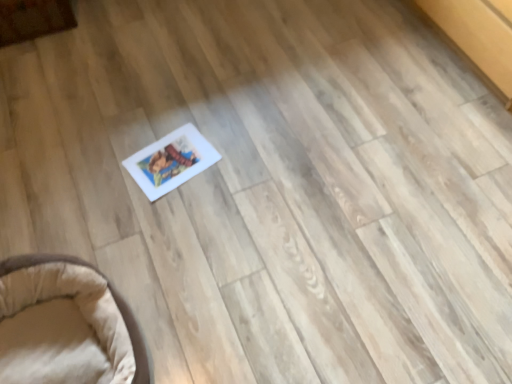
Describe the element at coordinates (114, 300) in the screenshot. I see `beige fabric pet bed at lower left, which is the second furniture from back to front` at that location.

The height and width of the screenshot is (384, 512). Find the location of `beige fabric pet bed at lower left, which appears as the second furniture when viewed from the left`. beige fabric pet bed at lower left, which appears as the second furniture when viewed from the left is located at coordinates tap(114, 300).

How much space does wooden cabinet at upper left, the second furniture in the front-to-back sequence, occupy vertically?

→ wooden cabinet at upper left, the second furniture in the front-to-back sequence, is 7.78 inches in height.

Where is `wooden cabinet at upper left, the 1th furniture from the left`? The width and height of the screenshot is (512, 384). wooden cabinet at upper left, the 1th furniture from the left is located at coordinates (33, 19).

The width and height of the screenshot is (512, 384). Describe the element at coordinates (33, 19) in the screenshot. I see `wooden cabinet at upper left, the 1th furniture from the left` at that location.

The width and height of the screenshot is (512, 384). I want to click on beige fabric pet bed at lower left, which is the first furniture in front-to-back order, so click(114, 300).

Is beige fabric pet bed at lower left, which is the first furniture in front-to-back order, at the right side of wooden cabinet at upper left, the second furniture in the front-to-back sequence?

Yes.

Which object is closer to the camera taking this photo, beige fabric pet bed at lower left, which appears as the 1th furniture when ordered from the bottom, or wooden cabinet at upper left, the 1th furniture from the left?

beige fabric pet bed at lower left, which appears as the 1th furniture when ordered from the bottom, is in front.

Considering the points (0, 266) and (22, 4), which point is in front, point (0, 266) or point (22, 4)?

The point (0, 266) is closer to the camera.

From the image's perspective, between beige fabric pet bed at lower left, which appears as the 1th furniture when ordered from the bottom, and wooden cabinet at upper left, which ranks as the second furniture in right-to-left order, which one is located above?

From the image's view, wooden cabinet at upper left, which ranks as the second furniture in right-to-left order, is above.

From a real-world perspective, which object stands above the other?

beige fabric pet bed at lower left, which is the first furniture in front-to-back order.

In the scene shown: Considering the relative sizes of beige fabric pet bed at lower left, which appears as the 1th furniture when ordered from the bottom, and wooden cabinet at upper left, the 1th furniture positioned from the top, in the image provided, is beige fabric pet bed at lower left, which appears as the 1th furniture when ordered from the bottom, wider than wooden cabinet at upper left, the 1th furniture positioned from the top,?

Yes, beige fabric pet bed at lower left, which appears as the 1th furniture when ordered from the bottom, is wider than wooden cabinet at upper left, the 1th furniture positioned from the top.

Who is shorter, beige fabric pet bed at lower left, placed as the 1th furniture when sorted from right to left, or wooden cabinet at upper left, the 1th furniture from the left?

With less height is wooden cabinet at upper left, the 1th furniture from the left.

Considering the sizes of objects beige fabric pet bed at lower left, which appears as the second furniture when viewed from the top, and wooden cabinet at upper left, the second furniture in the front-to-back sequence, in the image provided, who is bigger, beige fabric pet bed at lower left, which appears as the second furniture when viewed from the top, or wooden cabinet at upper left, the second furniture in the front-to-back sequence,?

beige fabric pet bed at lower left, which appears as the second furniture when viewed from the top, is bigger.

Can we say beige fabric pet bed at lower left, which is the second furniture from back to front, lies outside wooden cabinet at upper left, marked as the first furniture in a back-to-front arrangement?

Yes, beige fabric pet bed at lower left, which is the second furniture from back to front, is not within wooden cabinet at upper left, marked as the first furniture in a back-to-front arrangement.

Is beige fabric pet bed at lower left, placed as the 1th furniture when sorted from right to left, not close to wooden cabinet at upper left, the second furniture in the front-to-back sequence?

beige fabric pet bed at lower left, placed as the 1th furniture when sorted from right to left, is positioned a significant distance from wooden cabinet at upper left, the second furniture in the front-to-back sequence.

Could you tell me if beige fabric pet bed at lower left, which is the first furniture in front-to-back order, is facing wooden cabinet at upper left, marked as the first furniture in a back-to-front arrangement?

No, beige fabric pet bed at lower left, which is the first furniture in front-to-back order, is not aimed at wooden cabinet at upper left, marked as the first furniture in a back-to-front arrangement.

How many degrees apart are the facing directions of beige fabric pet bed at lower left, which appears as the second furniture when viewed from the left, and wooden cabinet at upper left, the 1th furniture from the left?

There is a 89.9-degree angle between the facing directions of beige fabric pet bed at lower left, which appears as the second furniture when viewed from the left, and wooden cabinet at upper left, the 1th furniture from the left.

This screenshot has height=384, width=512. In the image, there is a wooden cabinet at upper left, which ranks as the second furniture in right-to-left order. Find the location of `furniture below it (from the image's perspective)`. furniture below it (from the image's perspective) is located at coordinates (114, 300).

Which object is positioned more to the left, wooden cabinet at upper left, marked as the first furniture in a back-to-front arrangement, or beige fabric pet bed at lower left, which appears as the second furniture when viewed from the left?

wooden cabinet at upper left, marked as the first furniture in a back-to-front arrangement.

Considering the positions of objects wooden cabinet at upper left, the second furniture in the front-to-back sequence, and beige fabric pet bed at lower left, which is the first furniture in front-to-back order, in the image provided, who is in front, wooden cabinet at upper left, the second furniture in the front-to-back sequence, or beige fabric pet bed at lower left, which is the first furniture in front-to-back order,?

Positioned in front is beige fabric pet bed at lower left, which is the first furniture in front-to-back order.

Which is closer, (71, 16) or (136, 365)?

Point (71, 16) appears to be farther away from the viewer than point (136, 365).

Consider the image. From the image's perspective, is wooden cabinet at upper left, the second furniture in the front-to-back sequence, positioned above or below beige fabric pet bed at lower left, which is the first furniture in front-to-back order?

wooden cabinet at upper left, the second furniture in the front-to-back sequence, is situated higher than beige fabric pet bed at lower left, which is the first furniture in front-to-back order, in the image.

From a real-world perspective, relative to beige fabric pet bed at lower left, which is the first furniture in front-to-back order, is wooden cabinet at upper left, marked as the first furniture in a back-to-front arrangement, vertically above or below?

wooden cabinet at upper left, marked as the first furniture in a back-to-front arrangement, is situated lower than beige fabric pet bed at lower left, which is the first furniture in front-to-back order, in the real world.

Which of these two, wooden cabinet at upper left, the 1th furniture positioned from the top, or beige fabric pet bed at lower left, which is the second furniture from back to front, is thinner?

wooden cabinet at upper left, the 1th furniture positioned from the top, is thinner.

Considering the relative sizes of wooden cabinet at upper left, the second furniture in the front-to-back sequence, and beige fabric pet bed at lower left, which appears as the second furniture when viewed from the left, in the image provided, is wooden cabinet at upper left, the second furniture in the front-to-back sequence, shorter than beige fabric pet bed at lower left, which appears as the second furniture when viewed from the left,?

Correct, wooden cabinet at upper left, the second furniture in the front-to-back sequence, is not as tall as beige fabric pet bed at lower left, which appears as the second furniture when viewed from the left.

Does wooden cabinet at upper left, the 1th furniture positioned from the top, have a larger size compared to beige fabric pet bed at lower left, which appears as the second furniture when viewed from the top?

No, wooden cabinet at upper left, the 1th furniture positioned from the top, is not bigger than beige fabric pet bed at lower left, which appears as the second furniture when viewed from the top.

Looking at this image, is wooden cabinet at upper left, which ranks as the second furniture in right-to-left order, inside or outside of beige fabric pet bed at lower left, which appears as the second furniture when viewed from the left?

wooden cabinet at upper left, which ranks as the second furniture in right-to-left order, is not enclosed by beige fabric pet bed at lower left, which appears as the second furniture when viewed from the left.

Is wooden cabinet at upper left, the 1th furniture from the left, far away from beige fabric pet bed at lower left, which is the second furniture from back to front?

wooden cabinet at upper left, the 1th furniture from the left, is positioned a significant distance from beige fabric pet bed at lower left, which is the second furniture from back to front.

Is beige fabric pet bed at lower left, which appears as the second furniture when viewed from the top, at the back of wooden cabinet at upper left, marked as the first furniture in a back-to-front arrangement?

No, beige fabric pet bed at lower left, which appears as the second furniture when viewed from the top, is not at the back of wooden cabinet at upper left, marked as the first furniture in a back-to-front arrangement.

Can you tell me how much wooden cabinet at upper left, marked as the first furniture in a back-to-front arrangement, and beige fabric pet bed at lower left, which is the first furniture in front-to-back order, differ in facing direction?

The angle between the facing direction of wooden cabinet at upper left, marked as the first furniture in a back-to-front arrangement, and the facing direction of beige fabric pet bed at lower left, which is the first furniture in front-to-back order, is 89.9 degrees.

Image resolution: width=512 pixels, height=384 pixels. What are the coordinates of `furniture above the beige fabric pet bed at lower left, which appears as the second furniture when viewed from the left (from the image's perspective)` in the screenshot? It's located at (33, 19).

Where is `furniture that appears above the wooden cabinet at upper left, which ranks as the second furniture in right-to-left order (from a real-world perspective)`? The image size is (512, 384). furniture that appears above the wooden cabinet at upper left, which ranks as the second furniture in right-to-left order (from a real-world perspective) is located at coordinates (114, 300).

Locate an element on the screen. The height and width of the screenshot is (384, 512). furniture above the beige fabric pet bed at lower left, placed as the 1th furniture when sorted from right to left (from the image's perspective) is located at coordinates click(x=33, y=19).